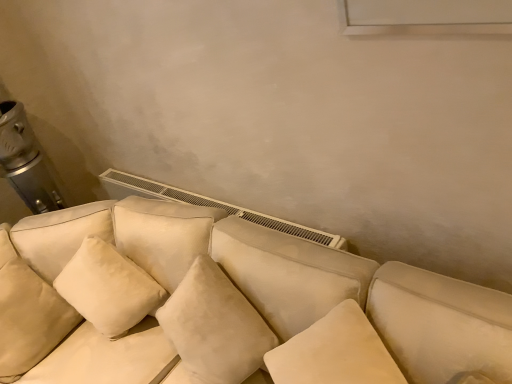
Question: Is suede-like beige couch at center not inside suede-like beige pillow at lower left?

Choices:
 (A) yes
 (B) no

Answer: (A)

Question: Considering the relative sizes of suede-like beige couch at center and suede-like beige pillow at lower left in the image provided, is suede-like beige couch at center wider than suede-like beige pillow at lower left?

Choices:
 (A) no
 (B) yes

Answer: (B)

Question: Does suede-like beige couch at center have a greater height compared to suede-like beige pillow at lower left?

Choices:
 (A) no
 (B) yes

Answer: (B)

Question: From a real-world perspective, is suede-like beige couch at center positioned under suede-like beige pillow at lower left based on gravity?

Choices:
 (A) no
 (B) yes

Answer: (B)

Question: Is suede-like beige couch at center at the left side of suede-like beige pillow at lower left?

Choices:
 (A) yes
 (B) no

Answer: (B)

Question: Is suede-like beige couch at center smaller than suede-like beige pillow at lower left?

Choices:
 (A) yes
 (B) no

Answer: (B)

Question: Considering the relative positions of suede-like beige pillow at lower left and suede-like beige couch at center in the image provided, is suede-like beige pillow at lower left in front of suede-like beige couch at center?

Choices:
 (A) no
 (B) yes

Answer: (A)

Question: From a real-world perspective, is suede-like beige pillow at lower left located beneath suede-like beige couch at center?

Choices:
 (A) yes
 (B) no

Answer: (B)

Question: Does suede-like beige pillow at lower left have a greater width compared to suede-like beige couch at center?

Choices:
 (A) yes
 (B) no

Answer: (B)

Question: From the image's perspective, would you say suede-like beige pillow at lower left is positioned over suede-like beige couch at center?

Choices:
 (A) no
 (B) yes

Answer: (B)

Question: From the image's perspective, is suede-like beige pillow at lower left below suede-like beige couch at center?

Choices:
 (A) yes
 (B) no

Answer: (B)

Question: Is suede-like beige pillow at lower left shorter than suede-like beige couch at center?

Choices:
 (A) no
 (B) yes

Answer: (B)

Question: Is suede-like beige couch at center inside or outside of suede-like beige pillow at lower left?

Choices:
 (A) inside
 (B) outside

Answer: (B)